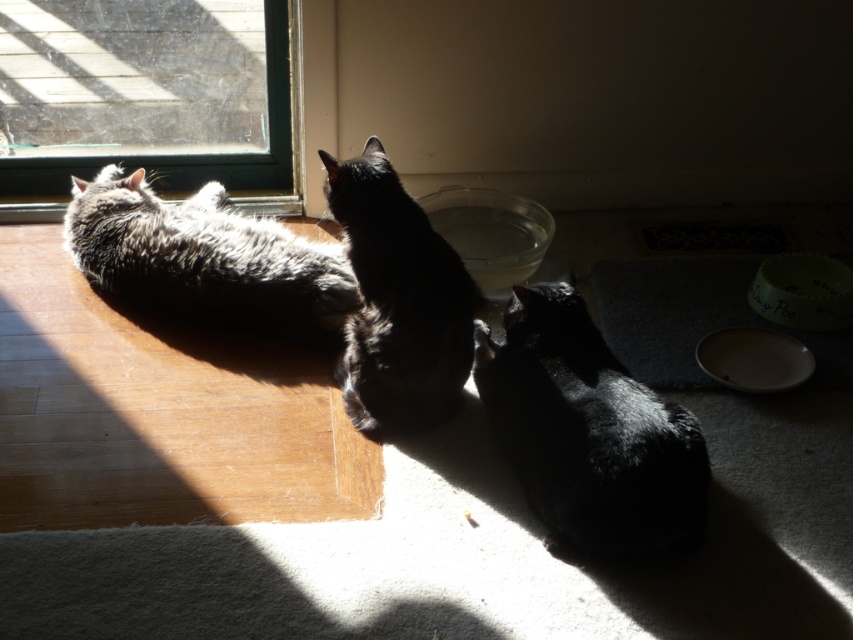
Question: Which point is farther to the camera?

Choices:
 (A) gray-furred cat at left
 (B) transparent glass window at upper left
 (C) black glossy cat at center

Answer: (B)

Question: Which point appears farthest from the camera in this image?

Choices:
 (A) (454, 260)
 (B) (213, 205)
 (C) (500, 387)
 (D) (56, 196)

Answer: (D)

Question: Is black fur cat at lower right to the right of gray-furred cat at left from the viewer's perspective?

Choices:
 (A) yes
 (B) no

Answer: (A)

Question: Which point appears closest to the camera in this image?

Choices:
 (A) (4, 138)
 (B) (396, 330)
 (C) (589, 356)

Answer: (C)

Question: Can you confirm if transparent glass window at upper left is bigger than gray-furred cat at left?

Choices:
 (A) no
 (B) yes

Answer: (A)

Question: Can you confirm if transparent glass window at upper left is positioned to the left of black glossy cat at center?

Choices:
 (A) no
 (B) yes

Answer: (B)